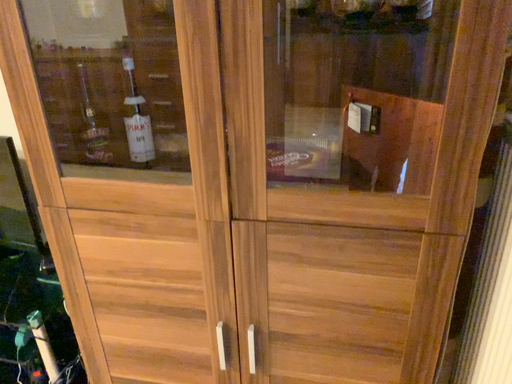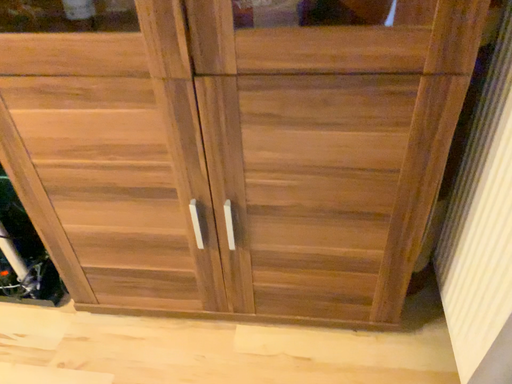
Question: Which way did the camera rotate in the video?

Choices:
 (A) rotated upward
 (B) rotated downward

Answer: (B)